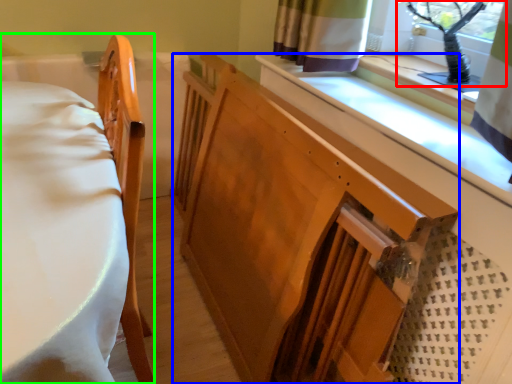
Question: Considering the real-world distances, which object is farthest from window screen (highlighted by a red box)? changing table (highlighted by a blue box) or furniture (highlighted by a green box)?

Choices:
 (A) changing table
 (B) furniture

Answer: (B)